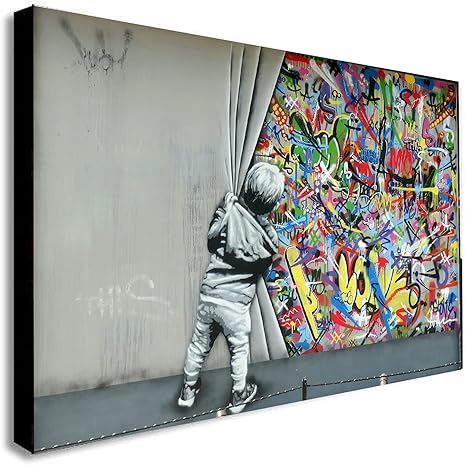
Where is `grey wall`? The image size is (466, 465). grey wall is located at coordinates (127, 165).